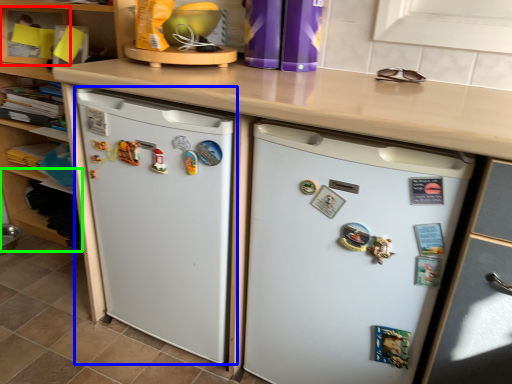
Question: Based on their relative distances, which object is nearer to shelf (highlighted by a red box)? Choose from refrigerator (highlighted by a blue box) and shelf (highlighted by a green box).

Choices:
 (A) refrigerator
 (B) shelf

Answer: (B)